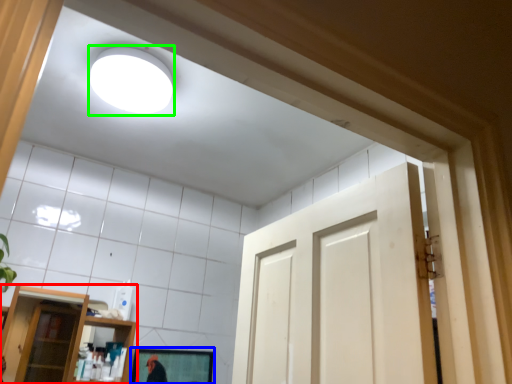
Question: Considering the real-world distances, which object is farthest from shelf (highlighted by a red box)? mirror (highlighted by a blue box) or lighting (highlighted by a green box)?

Choices:
 (A) mirror
 (B) lighting

Answer: (B)